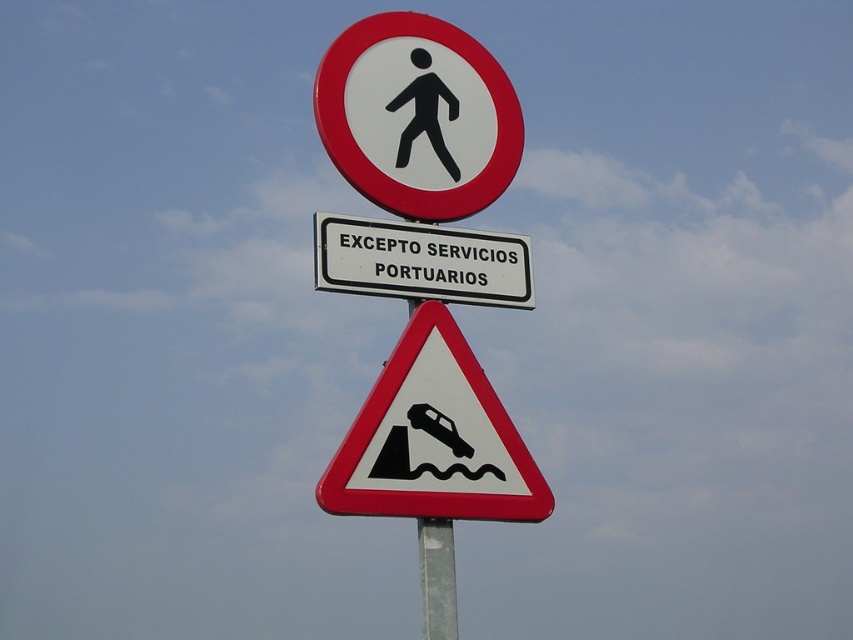
Question: Does white plastic pedestrian at upper center appear on the left side of white plastic text at center?

Choices:
 (A) no
 (B) yes

Answer: (B)

Question: Observing the image, what is the correct spatial positioning of white plastic pedestrian at upper center in reference to black plastic car at center?

Choices:
 (A) above
 (B) below

Answer: (A)

Question: Can you confirm if white plastic pedestrian at upper center is wider than white plastic text at center?

Choices:
 (A) yes
 (B) no

Answer: (B)

Question: Among these points, which one is nearest to the camera?

Choices:
 (A) (474, 148)
 (B) (390, 275)

Answer: (B)

Question: Which point is closer to the camera?

Choices:
 (A) black plastic car at center
 (B) white plastic text at center

Answer: (A)

Question: Based on their relative distances, which object is nearer to the white plastic pedestrian at upper center?

Choices:
 (A) white plastic text at center
 (B) black plastic car at center

Answer: (A)